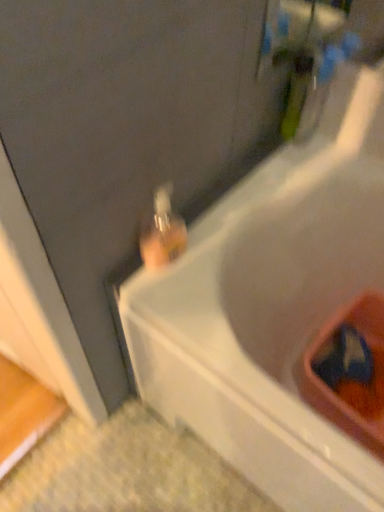
Identify the location of free spot in front of translucent glass bottle at upper center. (177, 306).